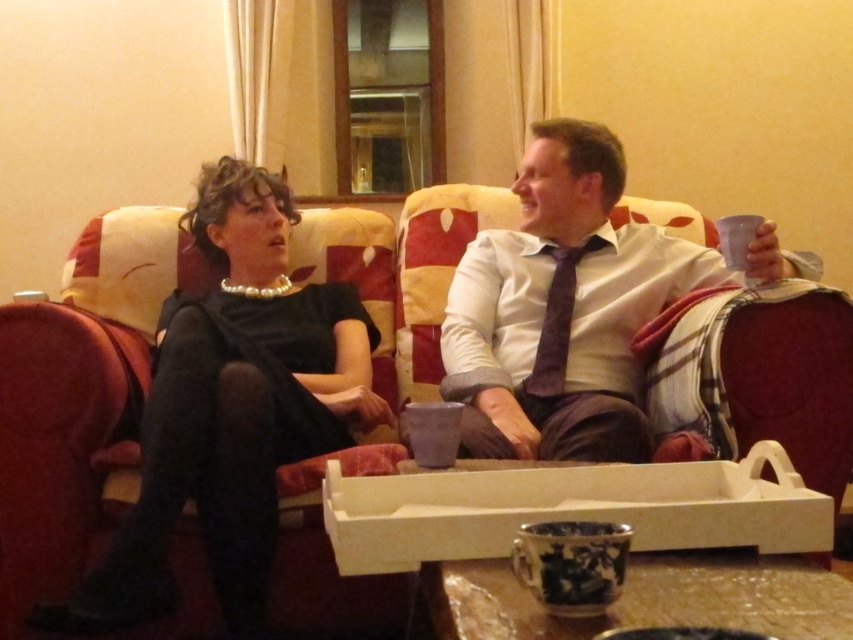
Question: Which point is closer to the camera?

Choices:
 (A) (606, 180)
 (B) (531, 378)
 (C) (239, 556)
 (D) (735, 320)

Answer: (C)

Question: Can you confirm if velvet-like beige couch at center is bigger than purple velvet tie at center?

Choices:
 (A) yes
 (B) no

Answer: (A)

Question: Can you confirm if black satin dress at center is wider than purple velvet tie at center?

Choices:
 (A) no
 (B) yes

Answer: (B)

Question: Which object is the farthest from the black satin dress at center?

Choices:
 (A) purple velvet tie at center
 (B) matte white shirt at center

Answer: (A)

Question: Based on their relative distances, which object is nearer to the velvet-like beige couch at center?

Choices:
 (A) black satin dress at center
 (B) matte white shirt at center

Answer: (A)

Question: Observing the image, what is the correct spatial positioning of black satin dress at center in reference to matte white shirt at center?

Choices:
 (A) above
 (B) below

Answer: (B)